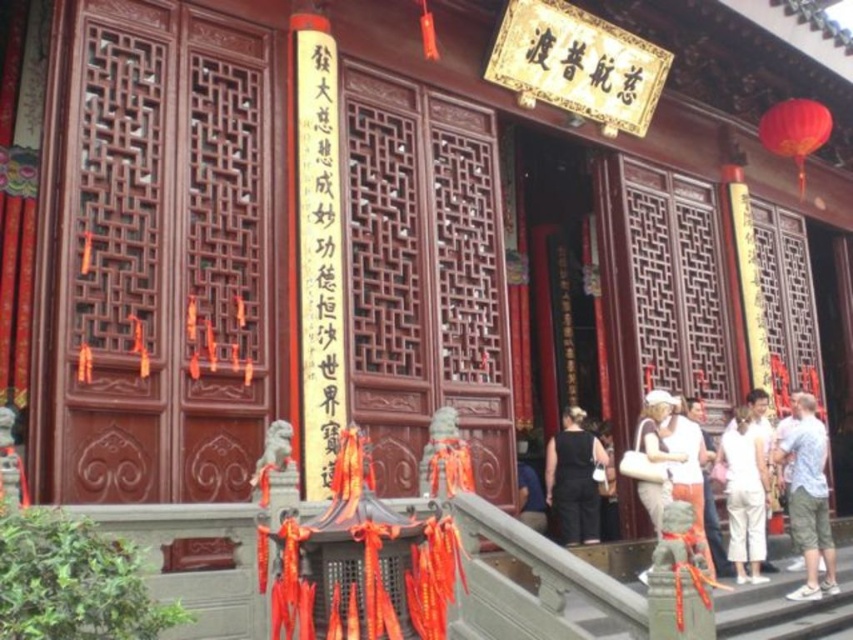
You are a visitor at this traditional Chinese building entrance. You notice two pieces of clothing items near the entrance. The white cotton pants at lower right and the black fabric dress at lower center. Which clothing item is taller?

The white cotton pants at lower right is taller than the black fabric dress at lower center.

You are standing at the entrance of a traditional Chinese building and want to take a photo of the point labeled as point (827, 557). Given that your camera has a maximum focus range of 30 meters, will you be able to capture the point clearly?

The point labeled as point (827, 557) is 35.36 meters away from the camera, which exceeds the maximum focus range of 30 meters. Therefore, you will not be able to capture the point clearly.

You are a visitor at this traditional Chinese building entrance and see both the light blue denim shorts at right and the black fabric dress at lower center. Which one is positioned more to the right side of the entrance?

The light blue denim shorts at right is positioned more to the right side of the entrance compared to the black fabric dress at lower center.